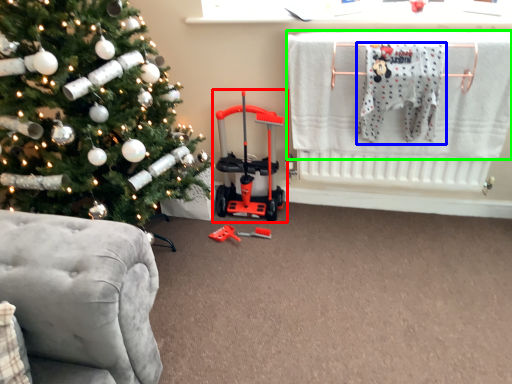
Question: Estimate the real-world distances between objects in this image. Which object is closer to baby carriage (highlighted by a red box), baby clothe (highlighted by a blue box) or laundry (highlighted by a green box)?

Choices:
 (A) baby clothe
 (B) laundry

Answer: (B)